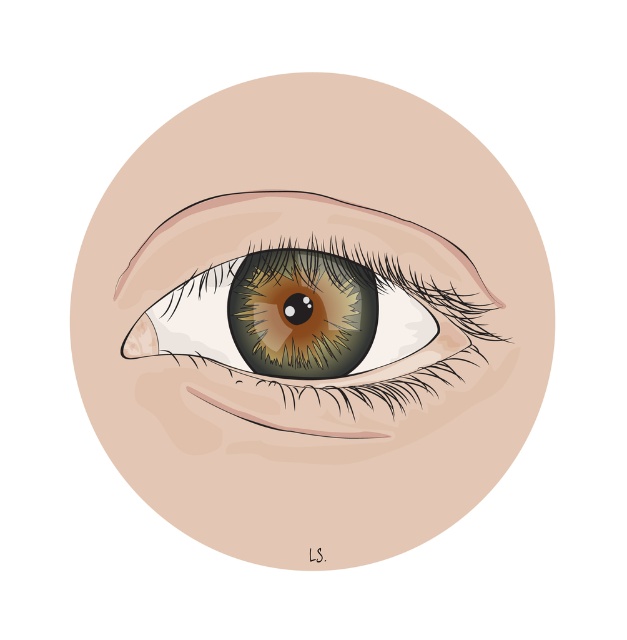
You are an artist trying to paint the eye in the image. You have two types of paint available, glossy and matte. Based on the spatial arrangement of the brown glossy eye at center and the brown matte eye at center, which paint should you use for the eye that appears closer to the viewer?

The brown glossy eye at center is in front of the brown matte eye at center, so to accurately represent the spatial arrangement, you should use glossy paint for the eye that appears closer to the viewer.

You are an artist trying to paint an eye. You have two reference images in front of you. One shows a brown glossy eye at center and the other shows a brown matte eye at center. According to the scene description, which eye do you think has a wider appearance?

The brown glossy eye at center might be wider than brown matte eye at center according to the description.

You are an artist trying to paint an eye. You have two reference images in front of you. One shows a brown glossy eye at center and the other shows a brown matte eye at center. Which reference image should you use if you want to paint an eye that appears bigger?

The brown glossy eye at center is larger in size than the brown matte eye at center, so you should use the reference image with the brown glossy eye at center to paint an eye that appears bigger.